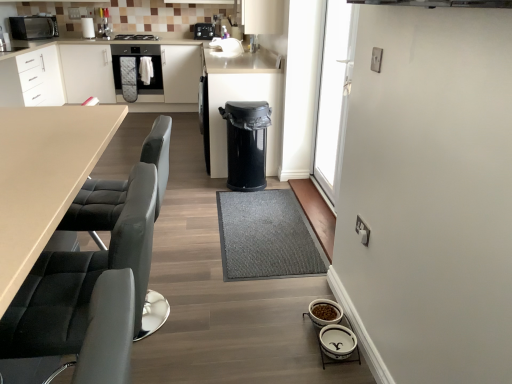
Question: Is black plastic toaster at upper center, the 1th appliance positioned from the top, to the right of gray textured mat at center from the viewer's perspective?

Choices:
 (A) yes
 (B) no

Answer: (B)

Question: Is black plastic toaster at upper center, the first appliance positioned from the back, outside of gray textured mat at center?

Choices:
 (A) no
 (B) yes

Answer: (B)

Question: Are black plastic toaster at upper center, arranged as the third appliance when ordered from the bottom, and gray textured mat at center beside each other?

Choices:
 (A) yes
 (B) no

Answer: (B)

Question: Does black plastic toaster at upper center, the 1th appliance positioned from the top, have a smaller size compared to gray textured mat at center?

Choices:
 (A) yes
 (B) no

Answer: (A)

Question: Could you tell me if black plastic toaster at upper center, the first appliance positioned from the back, is turned towards gray textured mat at center?

Choices:
 (A) yes
 (B) no

Answer: (A)

Question: Does black plastic toaster at upper center, the 3th appliance when ordered from front to back, have a greater width compared to gray textured mat at center?

Choices:
 (A) yes
 (B) no

Answer: (B)

Question: Is transparent glass door at upper right next to matte black microwave at upper left and touching it?

Choices:
 (A) no
 (B) yes

Answer: (A)

Question: Can you confirm if transparent glass door at upper right is shorter than matte black microwave at upper left?

Choices:
 (A) no
 (B) yes

Answer: (A)

Question: Is transparent glass door at upper right further to the viewer compared to matte black microwave at upper left?

Choices:
 (A) yes
 (B) no

Answer: (B)

Question: Is transparent glass door at upper right surrounding matte black microwave at upper left?

Choices:
 (A) yes
 (B) no

Answer: (B)

Question: Is the depth of transparent glass door at upper right less than that of matte black microwave at upper left?

Choices:
 (A) yes
 (B) no

Answer: (A)

Question: Is matte black microwave at upper left at the back of transparent glass door at upper right?

Choices:
 (A) yes
 (B) no

Answer: (B)

Question: Is black plastic trash can at center far from satin black oven at center?

Choices:
 (A) yes
 (B) no

Answer: (A)